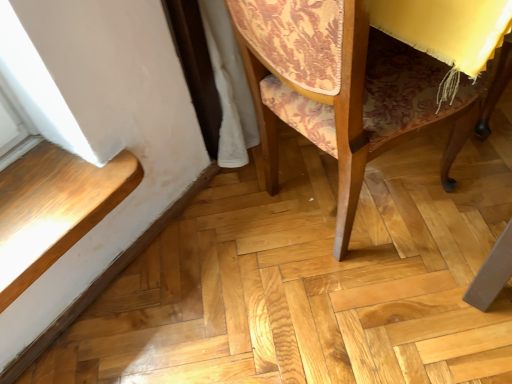
In order to click on free space in front of wooden floor at lower left in this screenshot , I will do `click(134, 324)`.